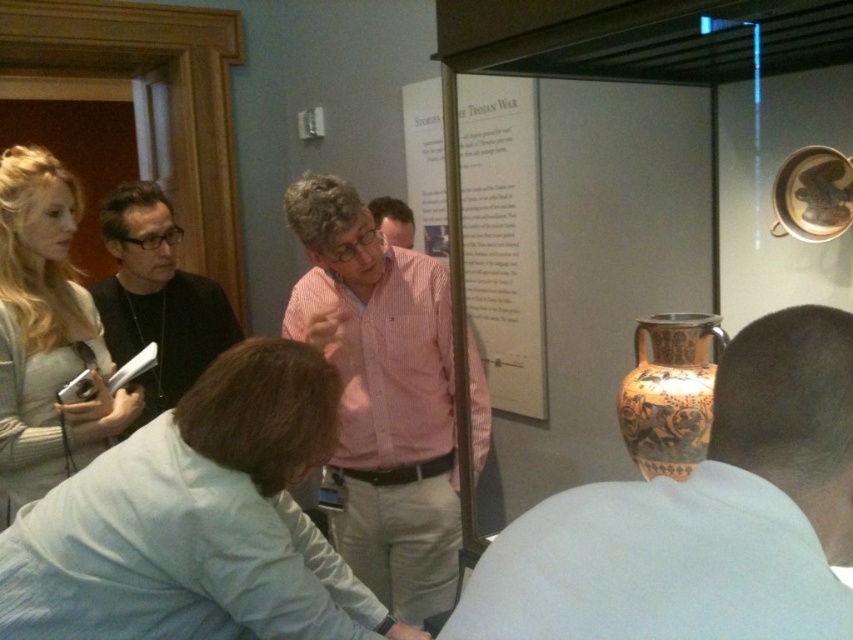
Between light blue shirt at lower left and pink striped shirt at center, which one is positioned higher?

pink striped shirt at center is above.

Does light blue shirt at lower left have a larger size compared to pink striped shirt at center?

No, light blue shirt at lower left is not bigger than pink striped shirt at center.

What are the coordinates of `light blue shirt at lower left` in the screenshot? It's located at (196, 522).

At what (x,y) coordinates should I click in order to perform the action: click on light blue shirt at lower left. Please return your answer as a coordinate pair (x, y). Looking at the image, I should click on (196, 522).

Looking at this image, is matte orange vase at center to the left of matte black shirt at left from the viewer's perspective?

No, matte orange vase at center is not to the left of matte black shirt at left.

Between matte orange vase at center and matte black shirt at left, which one appears on the left side from the viewer's perspective?

matte black shirt at left is more to the left.

Measure the distance between point (720, 436) and camera.

Point (720, 436) is 26.78 inches away from camera.

Where is `matte orange vase at center`? This screenshot has height=640, width=853. matte orange vase at center is located at coordinates (700, 516).

Is matte orange vase at center above light gray sweater at left?

Incorrect, matte orange vase at center is not positioned above light gray sweater at left.

Between matte orange vase at center and light gray sweater at left, which one has more height?

light gray sweater at left is taller.

Locate an element on the screen. matte orange vase at center is located at coordinates (700, 516).